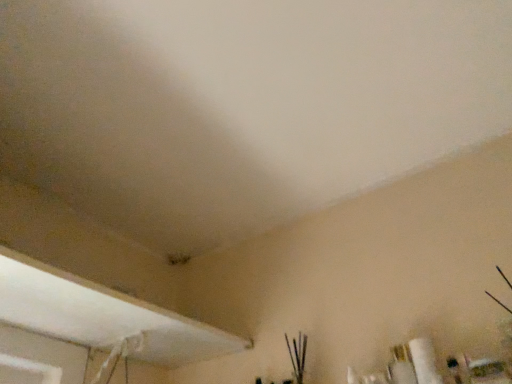
Find the location of a particular element. The height and width of the screenshot is (384, 512). white matte window sill at lower left is located at coordinates (103, 316).

What do you see at coordinates (103, 316) in the screenshot? I see `white matte window sill at lower left` at bounding box center [103, 316].

The height and width of the screenshot is (384, 512). I want to click on white matte window sill at lower left, so click(103, 316).